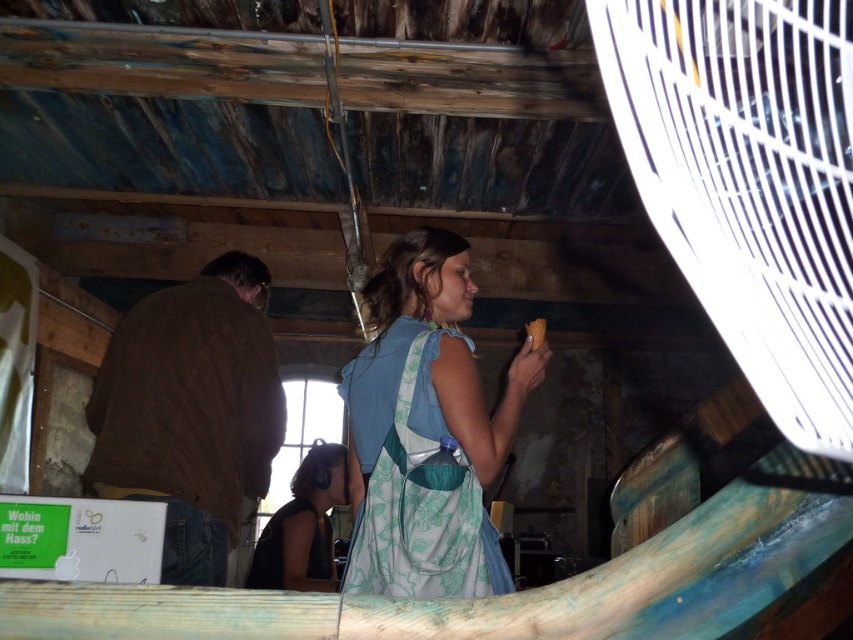
Question: Which point is farther to the camera?

Choices:
 (A) matte brown bread at center
 (B) dark blue fabric at lower center
 (C) light blue fabric dress at center

Answer: (B)

Question: Can you confirm if light blue fabric dress at center is thinner than dark blue fabric at lower center?

Choices:
 (A) no
 (B) yes

Answer: (B)

Question: Which object is the closest to the white plastic fan at upper right?

Choices:
 (A) light blue fabric dress at center
 (B) matte brown bread at center

Answer: (A)

Question: Can you confirm if light blue fabric dress at center is bigger than brown leather jacket at left?

Choices:
 (A) yes
 (B) no

Answer: (B)

Question: Is brown leather jacket at left below matte brown bread at center?

Choices:
 (A) yes
 (B) no

Answer: (A)

Question: Which point is farther to the camera?

Choices:
 (A) (535, 321)
 (B) (239, 420)
 (C) (796, 157)
 (D) (392, 252)

Answer: (C)